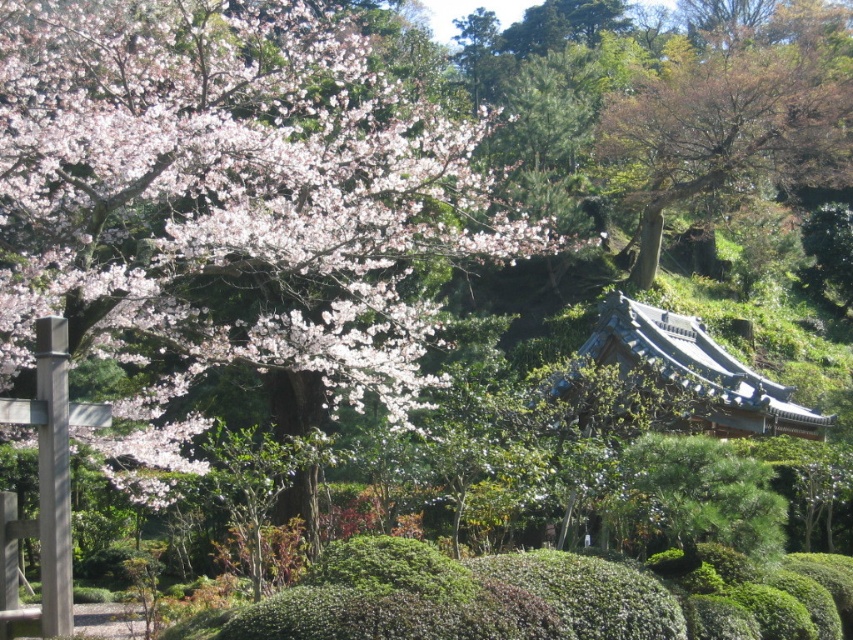
You are a visitor in the garden and want to take a photo of the soft pink blossoms at upper left and the brown textured tree at upper right. Which object should you focus on first if you want to capture both in a single frame without moving the camera?

You should focus on the brown textured tree at upper right first because it is taller than the soft pink blossoms at upper left, so it will occupy more space in the frame.

You are standing in the traditional Japanese garden and want to locate the point marked as point (231, 195). According to the scene description, where would this point be located?

The point (231, 195) is located on the soft pink blossoms at upper left.

You are a landscape architect designing a new garden and want to place a 40 meter long pathway between the soft pink blossoms at upper left and the brown textured tree at upper right. Based on the scene, will the pathway fit between them?

The distance between the soft pink blossoms at upper left and the brown textured tree at upper right is 39.35 meters, so a 40 meter long pathway would not fit as it is slightly longer than the available space.